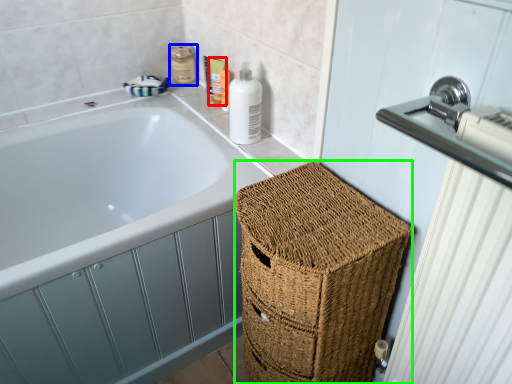
Question: Considering the real-world distances, which object is farthest from toiletry (highlighted by a red box)? toiletry (highlighted by a blue box) or basket (highlighted by a green box)?

Choices:
 (A) toiletry
 (B) basket

Answer: (B)